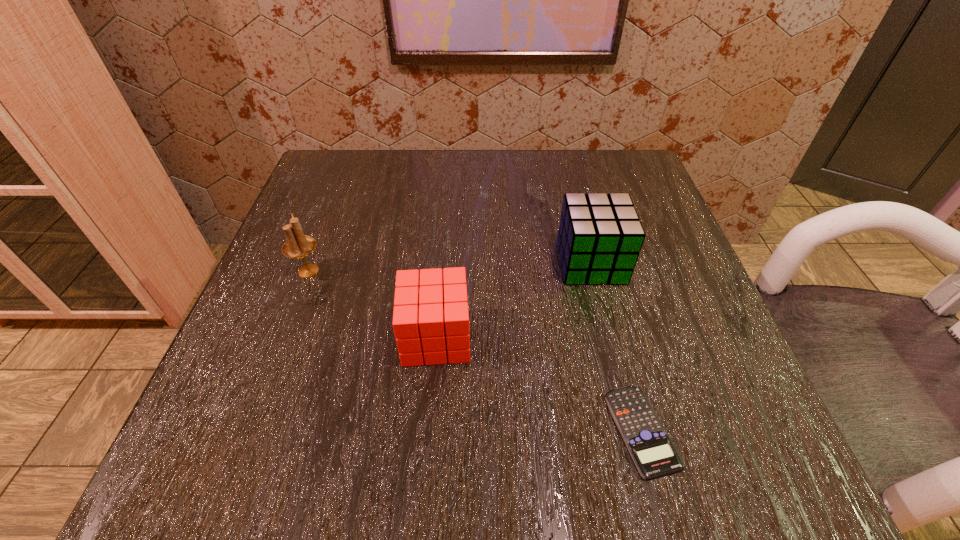
Identify the location of object positioned at the near edge. (652, 450).

The image size is (960, 540). I want to click on object that is at the left edge, so click(x=298, y=245).

The width and height of the screenshot is (960, 540). I want to click on cube situated at the right edge, so click(x=600, y=236).

Where is `calculator at the right edge`? This screenshot has width=960, height=540. calculator at the right edge is located at coordinates (652, 450).

At what (x,y) coordinates should I click in order to perform the action: click on object situated at the near right corner. Please return your answer as a coordinate pair (x, y). This screenshot has height=540, width=960. Looking at the image, I should click on (652, 450).

Image resolution: width=960 pixels, height=540 pixels. Find the location of `vacant region at the far edge of the desktop`. vacant region at the far edge of the desktop is located at coordinates click(x=490, y=191).

The image size is (960, 540). In the image, there is a desktop. Identify the location of blank space at the near edge. (407, 416).

Identify the location of vacant region at the left edge. (293, 276).

Identify the location of vacant space at the right edge. (607, 297).

Where is `blank space at the far left corner of the desktop`? blank space at the far left corner of the desktop is located at coordinates (305, 191).